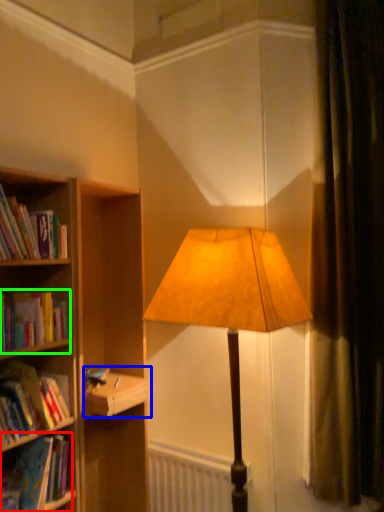
Question: Which object is the farthest from book (highlighted by a red box)? Choose among these: paperback book (highlighted by a blue box) or book (highlighted by a green box).

Choices:
 (A) paperback book
 (B) book

Answer: (B)